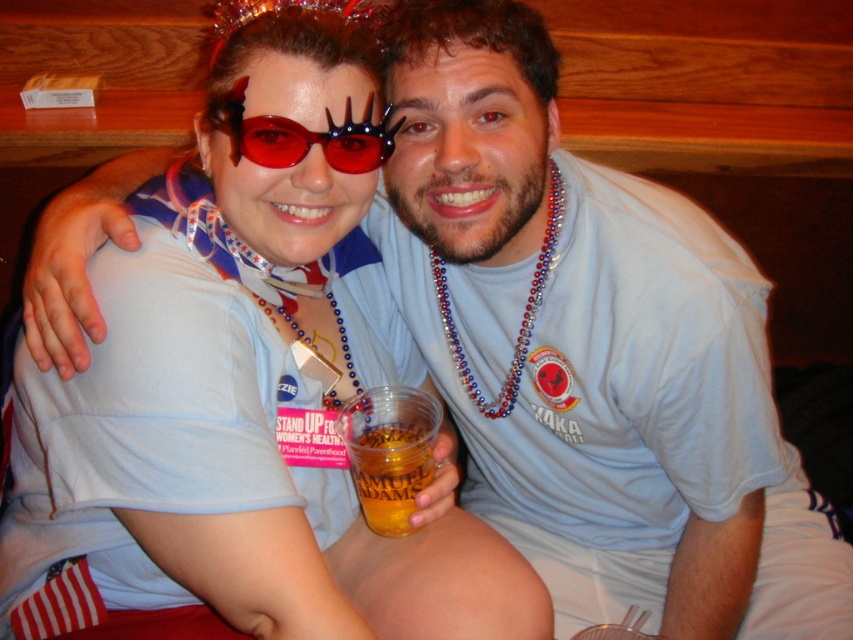
Which is behind, point (370, 115) or point (350, 456)?

The point (350, 456) is more distant.

Does red plastic goggles at center appear on the right side of translucent plastic cup at lower center?

In fact, red plastic goggles at center is to the left of translucent plastic cup at lower center.

Identify the location of red plastic goggles at center. (306, 136).

Locate an element on the screen. This screenshot has width=853, height=640. red plastic goggles at center is located at coordinates (306, 136).